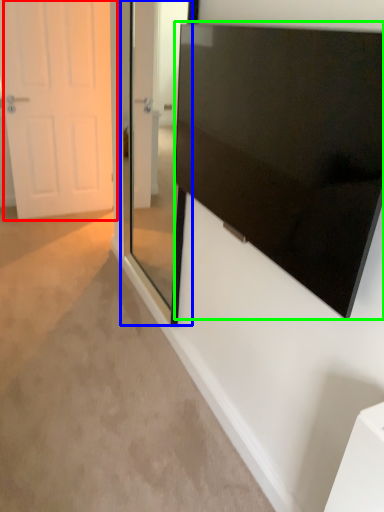
Question: Which object is the closest to the door (highlighted by a red box)? Choose among these: glass door (highlighted by a blue box) or screen (highlighted by a green box).

Choices:
 (A) glass door
 (B) screen

Answer: (A)